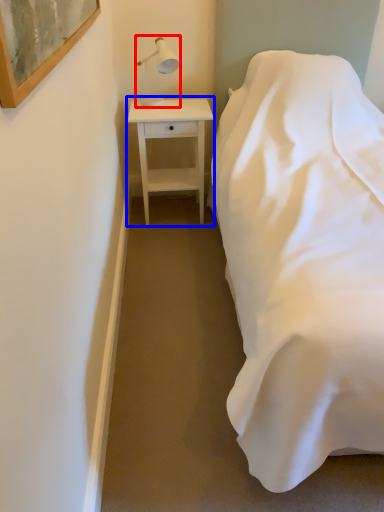
Question: Which point is closer to the camera, table lamp (highlighted by a red box) or nightstand (highlighted by a blue box)?

Choices:
 (A) table lamp
 (B) nightstand

Answer: (A)